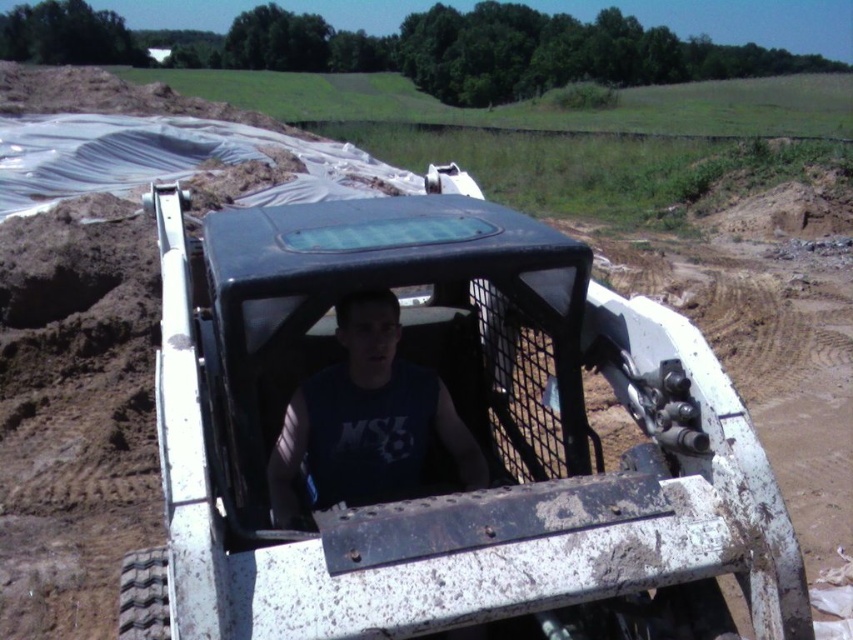
You are a mechanic trying to repair the white matte skid steer at center and the matte black tank top at center. You have a tool that can only reach up to 10 inches. Can you reach both objects with the tool without moving?

The white matte skid steer at center and the matte black tank top at center are 10.52 inches apart, so the tool cannot reach both objects without moving since the distance exceeds its 10 inches limit.

You are standing at the origin point of the coordinate system. There is a point labeled as point (439, 438) in the scene. What object is located at that point?

The point (439, 438) corresponds to the white matte skid steer at center.